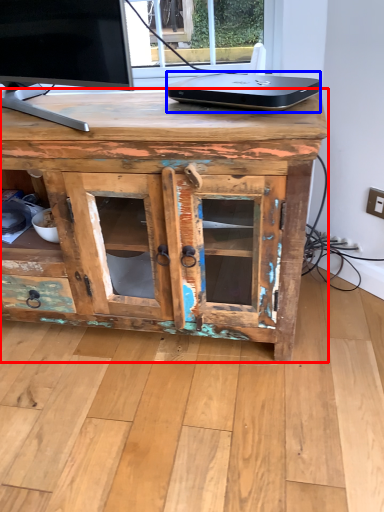
Question: Which object appears closest to the camera in this image, desk (highlighted by a red box) or laptop (highlighted by a blue box)?

Choices:
 (A) desk
 (B) laptop

Answer: (A)